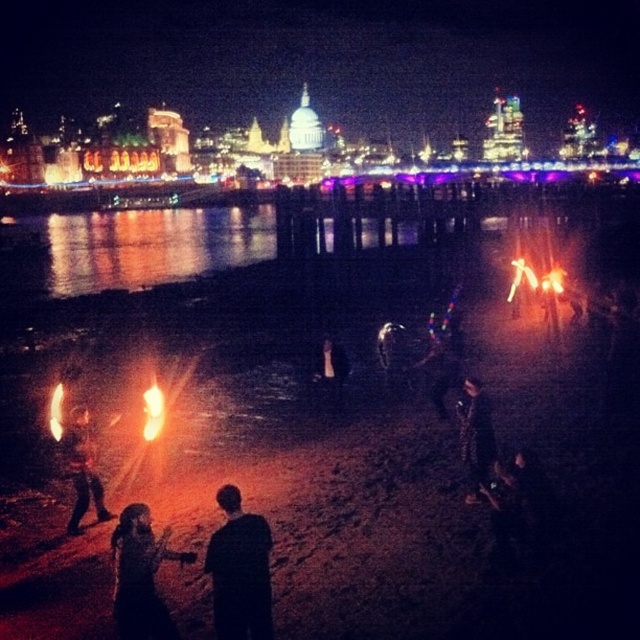
Between reflective glass water at center and orange flame at center, which one appears on the left side from the viewer's perspective?

orange flame at center

Which is behind, point (356, 244) or point (154, 429)?

The point (356, 244) is more distant.

Identify the location of reflective glass water at center. The width and height of the screenshot is (640, 640). (141, 248).

Describe the element at coordinates (141, 248) in the screenshot. I see `reflective glass water at center` at that location.

Consider the image. Can you confirm if reflective glass water at center is shorter than shiny metallic fire at lower left?

Incorrect, reflective glass water at center's height does not fall short of shiny metallic fire at lower left's.

Is point (173, 240) positioned in front of point (93, 484)?

No, (173, 240) is behind (93, 484).

Identify the location of reflective glass water at center. (141, 248).

Who is shorter, reflective glass water at center or dark fabric dress at lower center?

dark fabric dress at lower center is shorter.

From the picture: Between reflective glass water at center and dark fabric dress at lower center, which one appears on the right side from the viewer's perspective?

dark fabric dress at lower center is more to the right.

Does point (268, 216) lie in front of point (128, 620)?

No, it is not.

Where is `reflective glass water at center`? The width and height of the screenshot is (640, 640). reflective glass water at center is located at coordinates (141, 248).